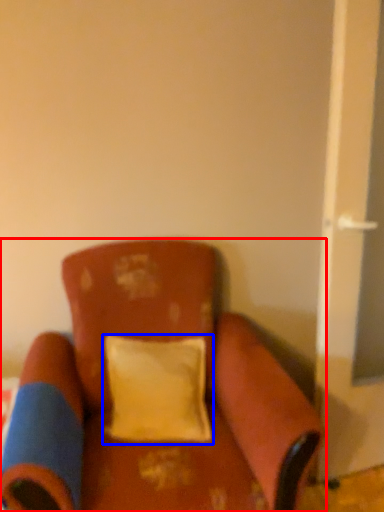
Question: Which object appears farthest to the camera in this image, chair (highlighted by a red box) or pillow (highlighted by a blue box)?

Choices:
 (A) chair
 (B) pillow

Answer: (B)